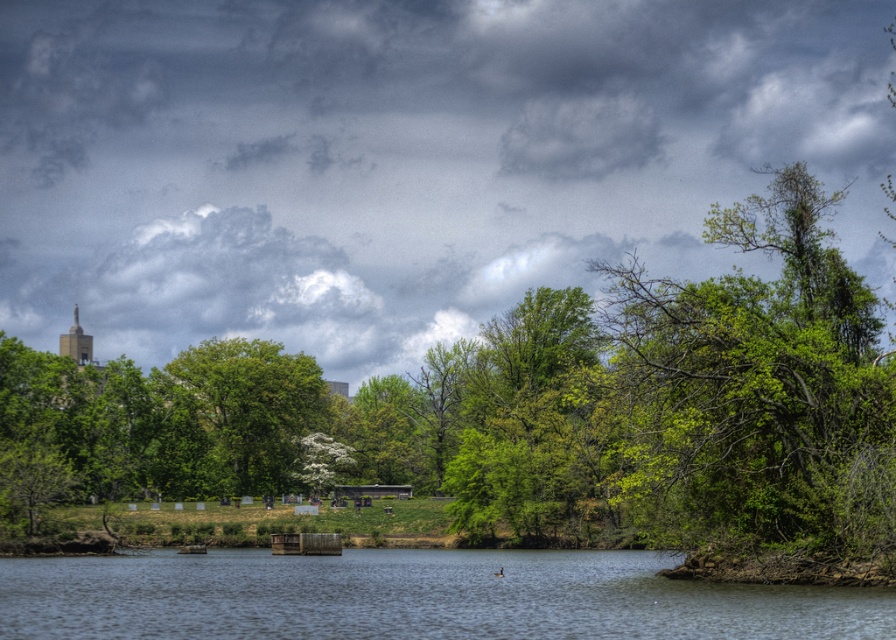
Can you confirm if clear water at center is positioned to the right of green leafy tree at center?

Indeed, clear water at center is positioned on the right side of green leafy tree at center.

Who is more forward, (765, 596) or (210, 385)?

Point (765, 596)

What do you see at coordinates (414, 596) in the screenshot?
I see `clear water at center` at bounding box center [414, 596].

The width and height of the screenshot is (896, 640). Find the location of `clear water at center`. clear water at center is located at coordinates (414, 596).